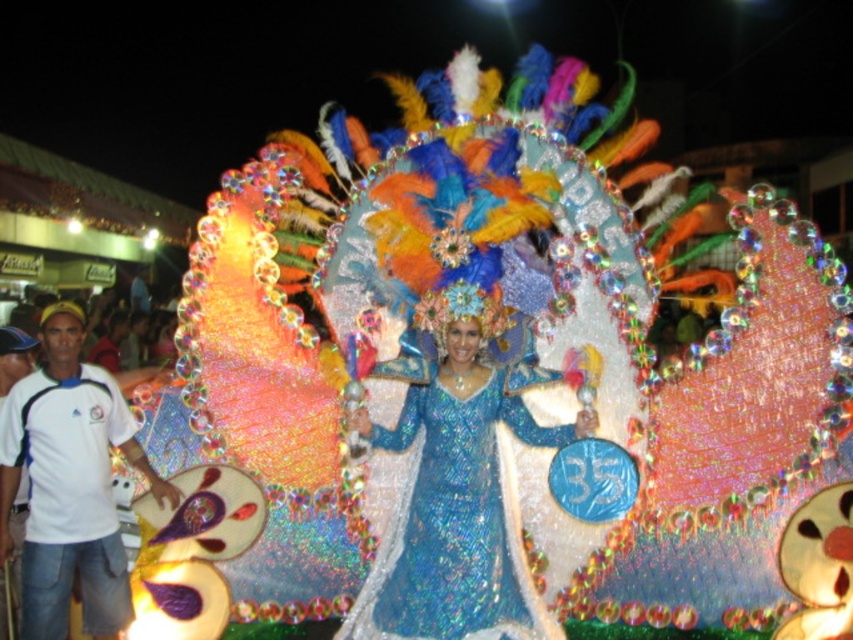
In the scene shown: Who is positioned more to the left, shiny blue dress at center or white cotton shirt at lower left?

From the viewer's perspective, white cotton shirt at lower left appears more on the left side.

Is shiny blue dress at center shorter than white cotton shirt at lower left?

Yes, shiny blue dress at center is shorter than white cotton shirt at lower left.

The width and height of the screenshot is (853, 640). Describe the element at coordinates (457, 497) in the screenshot. I see `shiny blue dress at center` at that location.

You are a GUI agent. You are given a task and a screenshot of the screen. Output one action in this format:
    pyautogui.click(x=<x>, y=<y>)
    Task: Click on the shiny blue dress at center
    This screenshot has width=853, height=640.
    Given the screenshot: What is the action you would take?
    pyautogui.click(x=457, y=497)

Is white cotton shirt at lower left wider than white cotton shirt at left?

Correct, the width of white cotton shirt at lower left exceeds that of white cotton shirt at left.

Is point (15, 483) behind point (12, 628)?

No, (15, 483) is in front of (12, 628).

This screenshot has height=640, width=853. Identify the location of white cotton shirt at lower left. coord(68,484).

Does shiny blue dress at center appear on the left side of white cotton shirt at left?

In fact, shiny blue dress at center is to the right of white cotton shirt at left.

Which is behind, point (490, 557) or point (13, 586)?

The point (13, 586) is behind.

Who is more forward, (459, 630) or (0, 605)?

Point (459, 630)

At what (x,y) coordinates should I click in order to perform the action: click on shiny blue dress at center. Please return your answer as a coordinate pair (x, y). Image resolution: width=853 pixels, height=640 pixels. Looking at the image, I should click on (457, 497).